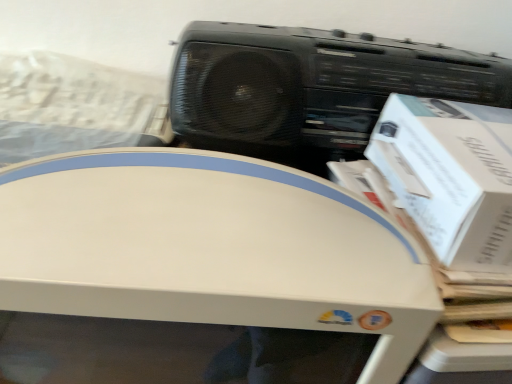
Locate an element on the screen. Image resolution: width=512 pixels, height=384 pixels. black plastic cassette at upper right is located at coordinates (311, 87).

The width and height of the screenshot is (512, 384). What do you see at coordinates (211, 248) in the screenshot? I see `white plastic printer at center` at bounding box center [211, 248].

Where is `white cardboard box at right`? The width and height of the screenshot is (512, 384). white cardboard box at right is located at coordinates [x=451, y=176].

Considering the sizes of objects black plastic cassette at upper right and white plastic printer at center in the image provided, who is smaller, black plastic cassette at upper right or white plastic printer at center?

black plastic cassette at upper right.

Considering the points (421, 87) and (126, 178), which point is in front, point (421, 87) or point (126, 178)?

Positioned in front is point (126, 178).

Is black plastic cassette at upper right at the left side of white plastic printer at center?

In fact, black plastic cassette at upper right is to the right of white plastic printer at center.

Can you confirm if black plastic cassette at upper right is taller than white plastic printer at center?

Incorrect, the height of black plastic cassette at upper right is not larger of that of white plastic printer at center.

Between white plastic printer at center and white cardboard box at right, which one appears on the right side from the viewer's perspective?

Positioned to the right is white cardboard box at right.

Is white plastic printer at center positioned far away from white cardboard box at right?

They are positioned close to each other.

Is point (229, 194) in front of point (425, 146)?

Yes.

Considering the relative sizes of black plastic cassette at upper right and white cardboard box at right in the image provided, is black plastic cassette at upper right thinner than white cardboard box at right?

Correct, the width of black plastic cassette at upper right is less than that of white cardboard box at right.

Which of these two, black plastic cassette at upper right or white cardboard box at right, is bigger?

With larger size is black plastic cassette at upper right.

Is black plastic cassette at upper right to the left of white cardboard box at right from the viewer's perspective?

Yes, black plastic cassette at upper right is to the left of white cardboard box at right.

Could you tell me if black plastic cassette at upper right is turned towards white cardboard box at right?

Yes, black plastic cassette at upper right is oriented towards white cardboard box at right.

Is white cardboard box at right aimed at black plastic cassette at upper right?

No, white cardboard box at right is not facing towards black plastic cassette at upper right.

Would you consider white cardboard box at right to be distant from black plastic cassette at upper right?

white cardboard box at right is actually quite close to black plastic cassette at upper right.

Where is `cassette above the white cardboard box at right (from the image's perspective)`? The height and width of the screenshot is (384, 512). cassette above the white cardboard box at right (from the image's perspective) is located at coordinates (311, 87).

Is black plastic cassette at upper right located within white cardboard box at right?

No, black plastic cassette at upper right is not a part of white cardboard box at right.

Considering the relative sizes of white plastic printer at center and black plastic cassette at upper right in the image provided, is white plastic printer at center thinner than black plastic cassette at upper right?

No, white plastic printer at center is not thinner than black plastic cassette at upper right.

Is white plastic printer at center facing towards black plastic cassette at upper right?

No, white plastic printer at center is not aimed at black plastic cassette at upper right.

Considering the positions of objects white plastic printer at center and black plastic cassette at upper right in the image provided, who is more to the right, white plastic printer at center or black plastic cassette at upper right?

black plastic cassette at upper right is more to the right.

Is white plastic printer at center positioned beyond the bounds of black plastic cassette at upper right?

white plastic printer at center is positioned outside black plastic cassette at upper right.

Based on the photo, considering the relative sizes of white cardboard box at right and white plastic printer at center in the image provided, is white cardboard box at right wider than white plastic printer at center?

No, white cardboard box at right is not wider than white plastic printer at center.

Considering the relative sizes of white cardboard box at right and white plastic printer at center in the image provided, is white cardboard box at right bigger than white plastic printer at center?

No, white cardboard box at right is not bigger than white plastic printer at center.

How distant is white cardboard box at right from white plastic printer at center?

white cardboard box at right and white plastic printer at center are 14.79 centimeters apart.

From the picture: Is white cardboard box at right not inside white plastic printer at center?

Absolutely, white cardboard box at right is external to white plastic printer at center.

In order to click on cassette behind the white plastic printer at center in this screenshot , I will do `click(311, 87)`.

Locate an element on the screen. home appliance that is on the left side of white cardboard box at right is located at coordinates (211, 248).

Looking at this image, looking at the image, which one is located closer to white cardboard box at right, black plastic cassette at upper right or white plastic printer at center?

black plastic cassette at upper right lies closer to white cardboard box at right than the other object.

From the image, which object appears to be farther from black plastic cassette at upper right, white cardboard box at right or white plastic printer at center?

Among the two, white plastic printer at center is located further to black plastic cassette at upper right.

Looking at the image, which one is located further to white plastic printer at center, white cardboard box at right or black plastic cassette at upper right?

Among the two, black plastic cassette at upper right is located further to white plastic printer at center.

Which object lies further to the anchor point white cardboard box at right, white plastic printer at center or black plastic cassette at upper right?

Based on the image, white plastic printer at center appears to be further to white cardboard box at right.

Based on their spatial positions, is black plastic cassette at upper right or white cardboard box at right further from white plastic printer at center?

black plastic cassette at upper right.

Estimate the real-world distances between objects in this image. Which object is further from black plastic cassette at upper right, white plastic printer at center or white cardboard box at right?

Among the two, white plastic printer at center is located further to black plastic cassette at upper right.

Identify the location of cassette located between white plastic printer at center and white cardboard box at right in the left-right direction. Image resolution: width=512 pixels, height=384 pixels. (311, 87).